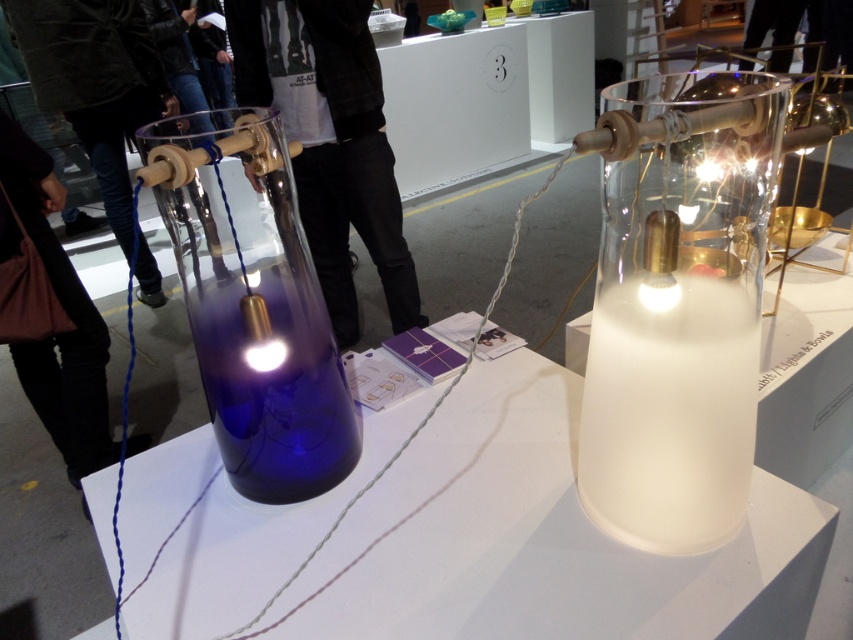
Question: Observing the image, what is the correct spatial positioning of satin white lamp at center in reference to black leather pants at lower left?

Choices:
 (A) below
 (B) above

Answer: (A)

Question: Which point is farther from the camera taking this photo?

Choices:
 (A) (79, 336)
 (B) (251, 588)
 (C) (659, 307)
 (D) (186, 208)

Answer: (A)

Question: Which of the following is the farthest from the observer?

Choices:
 (A) (581, 452)
 (B) (173, 468)
 (C) (216, 284)

Answer: (B)

Question: Is black cotton pants at left to the right of black leather pants at lower left from the viewer's perspective?

Choices:
 (A) yes
 (B) no

Answer: (A)

Question: Observing the image, what is the correct spatial positioning of translucent white string at center in reference to translucent white lampshade at center?

Choices:
 (A) right
 (B) left

Answer: (B)

Question: Which point is closer to the camera?

Choices:
 (A) (329, 150)
 (B) (666, 298)
 (C) (548, 451)
 (D) (3, 161)

Answer: (B)